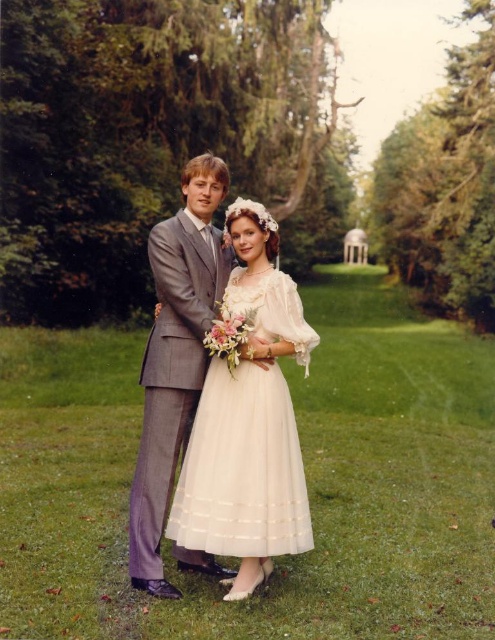
You are a photographer at a wedding. You need to capture a photo of the sheer white dress at center and the gray textured suit at center. Based on their positions, which one is closer to the camera?

The sheer white dress at center is positioned under the gray textured suit at center, so the gray textured suit at center is closer to the camera.